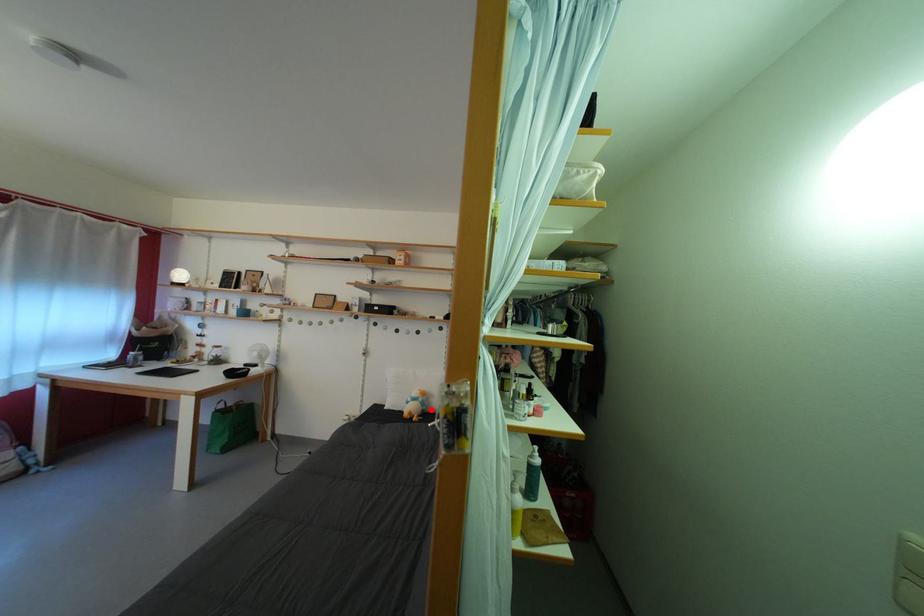
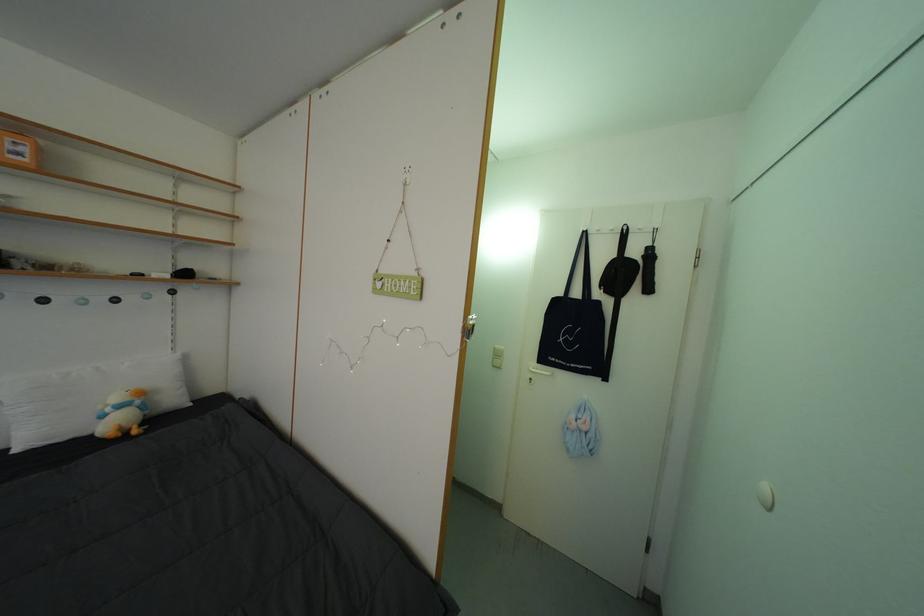
Question: A red point is marked in image1. In image2, is the corresponding 3D point closer to the camera or farther? Reply with the corresponding letter.

Choices:
 (A) The corresponding 3D point is closer.
 (B) The corresponding 3D point is farther.

Answer: (A)